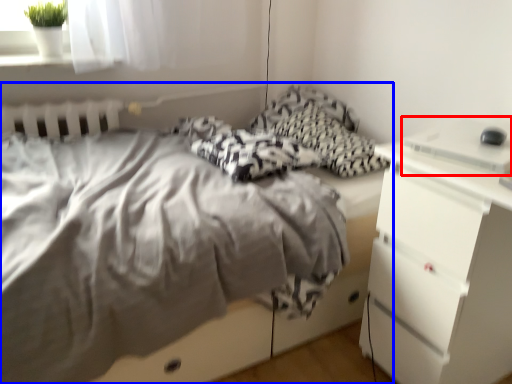
Question: Which of the following is the farthest to the observer, desktop (highlighted by a red box) or bed (highlighted by a blue box)?

Choices:
 (A) desktop
 (B) bed

Answer: (A)